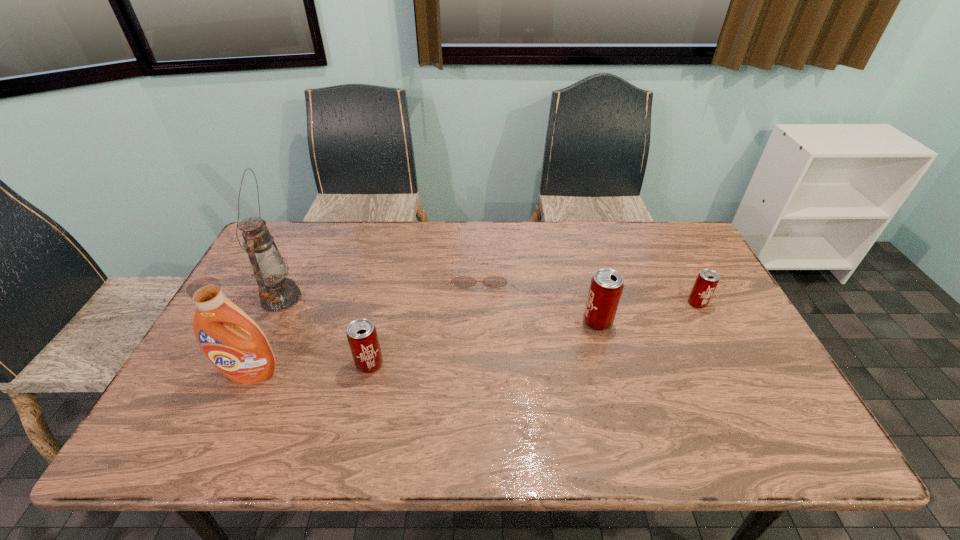
Image resolution: width=960 pixels, height=540 pixels. In order to click on the leftmost beer can in this screenshot , I will do `click(362, 336)`.

Where is `the nearest beer can`? The image size is (960, 540). the nearest beer can is located at coordinates (362, 336).

I want to click on the fifth object from left to right, so click(x=606, y=286).

The image size is (960, 540). Find the location of `the second nearest beer can`. the second nearest beer can is located at coordinates (606, 286).

This screenshot has height=540, width=960. I want to click on the second shortest object, so click(707, 280).

Where is `the rightmost object`? The image size is (960, 540). the rightmost object is located at coordinates (707, 280).

You are a GUI agent. You are given a task and a screenshot of the screen. Output one action in this format:
    pyautogui.click(x=<x>, y=<y>)
    Task: Click on the detergent
    This screenshot has width=960, height=540.
    Given the screenshot: What is the action you would take?
    pyautogui.click(x=233, y=342)

In order to click on oil lamp in this screenshot , I will do `click(277, 293)`.

Locate an element on the screen. The height and width of the screenshot is (540, 960). the shortest object is located at coordinates click(x=461, y=281).

Identify the location of the fourth object from left to right. This screenshot has width=960, height=540. (461, 281).